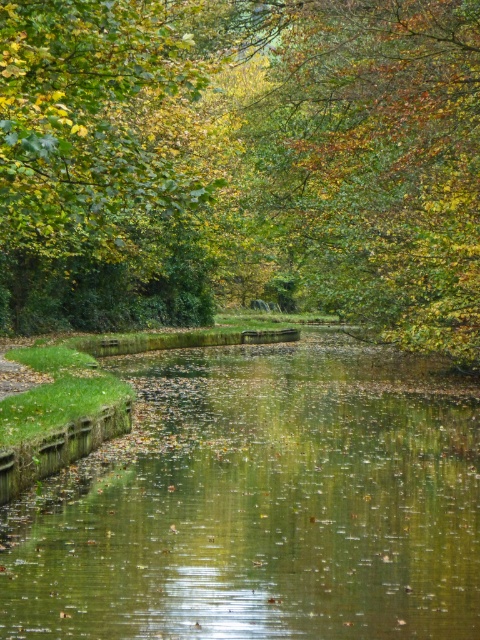
Is green leafy tree at center below green leafy tree at upper center?

No, green leafy tree at center is not below green leafy tree at upper center.

Is green leafy tree at center further to camera compared to green leafy tree at upper center?

Yes, green leafy tree at center is behind green leafy tree at upper center.

The width and height of the screenshot is (480, 640). What are the coordinates of `green leafy tree at center` in the screenshot? It's located at (241, 163).

Find the location of a particular element. This screenshot has width=480, height=640. green leafy tree at center is located at coordinates (241, 163).

Is green leafy tree at center to the left of green reflective water at center from the viewer's perspective?

Indeed, green leafy tree at center is positioned on the left side of green reflective water at center.

Which is more to the left, green leafy tree at center or green reflective water at center?

Positioned to the left is green leafy tree at center.

Between point (97, 179) and point (294, 442), which one is positioned in front?

Point (97, 179)

Where is `green leafy tree at center`? This screenshot has width=480, height=640. green leafy tree at center is located at coordinates (241, 163).

Between green reflective water at center and green leafy tree at upper center, which one has more height?

green leafy tree at upper center

Is green reflective water at center to the left of green leafy tree at upper center from the viewer's perspective?

Incorrect, green reflective water at center is not on the left side of green leafy tree at upper center.

Which is in front, point (39, 490) or point (108, 120)?

Point (39, 490)

Where is `green reflective water at center`? Image resolution: width=480 pixels, height=640 pixels. green reflective water at center is located at coordinates (261, 502).